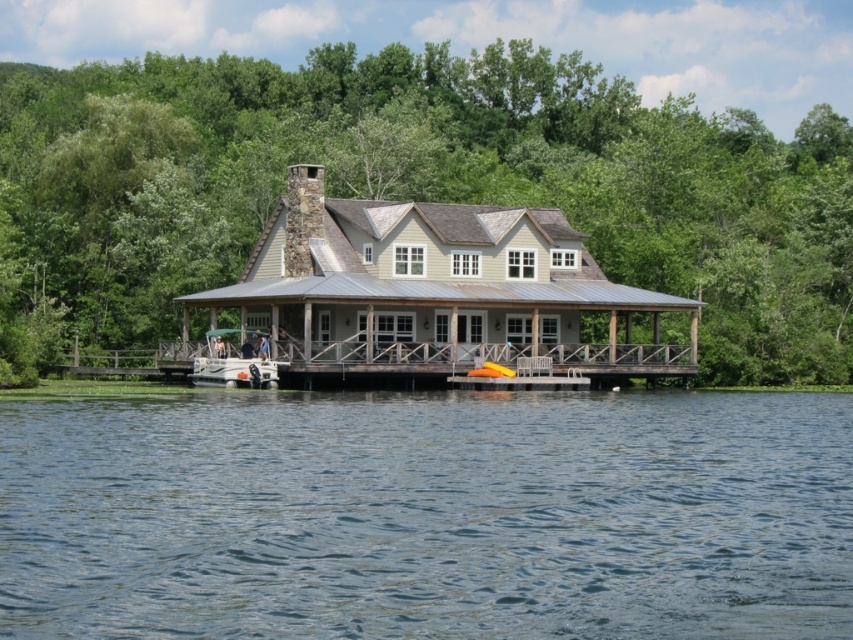
Does point (498, 342) come in front of point (276, 380)?

No, it is not.

Which is below, wooden at center or white plastic boat at center?

wooden at center is below.

Measure the distance between point (x=637, y=349) and camera.

Point (x=637, y=349) and camera are 89.14 meters apart from each other.

Identify the location of wooden at center. (397, 356).

Can you confirm if clear blue water at center is positioned above white plastic boat at center?

No, clear blue water at center is not above white plastic boat at center.

Can you confirm if clear blue water at center is smaller than white plastic boat at center?

Actually, clear blue water at center might be larger than white plastic boat at center.

Image resolution: width=853 pixels, height=640 pixels. I want to click on clear blue water at center, so click(427, 515).

Does clear blue water at center have a lesser width compared to wooden at center?

Incorrect, clear blue water at center's width is not less than wooden at center's.

Does point (683, 589) lie behind point (694, 365)?

No, (683, 589) is closer to viewer.

Identify the location of clear blue water at center. The width and height of the screenshot is (853, 640). (427, 515).